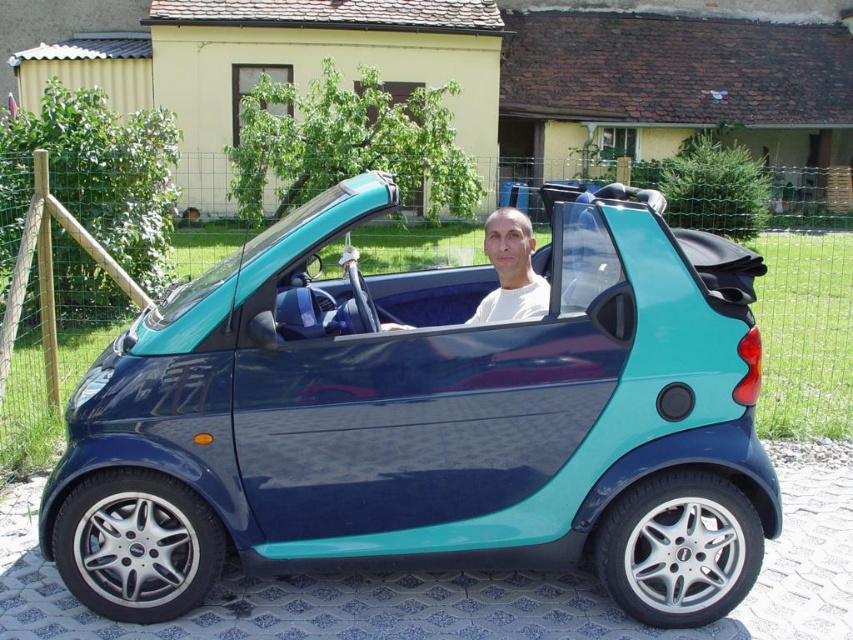
You are a photographer setting up a shoot in front of a residential area. You have a teal glossy car at center and a white matte shirt at center in your frame. Based on their sizes, which object would you adjust your camera settings for to ensure proper focus?

The teal glossy car at center is bigger than the white matte shirt at center, so you should adjust your camera settings to focus on the teal glossy car at center since it occupies more space in the frame.

You are a photographer standing in front of the teal glossy car at center and the white matte shirt at center. You want to capture a photo where both subjects are in focus. Since the car is taller than the shirt, which subject should you adjust your camera angle to focus on first to ensure both are in frame?

The teal glossy car at center is taller than the white matte shirt at center, so you should adjust your camera angle to focus on the teal glossy car at center first to ensure both are in frame.